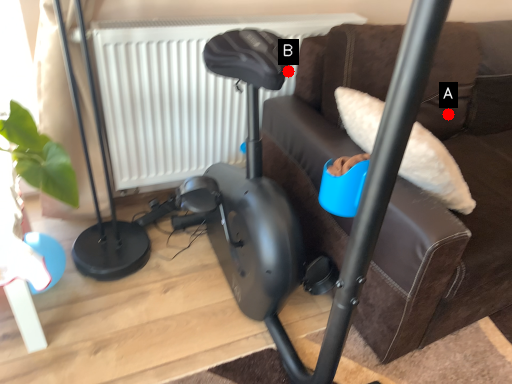
Question: Two points are circled on the image, labeled by A and B beside each circle. Which point is farther from the camera taking this photo?

Choices:
 (A) A is further
 (B) B is further

Answer: (A)